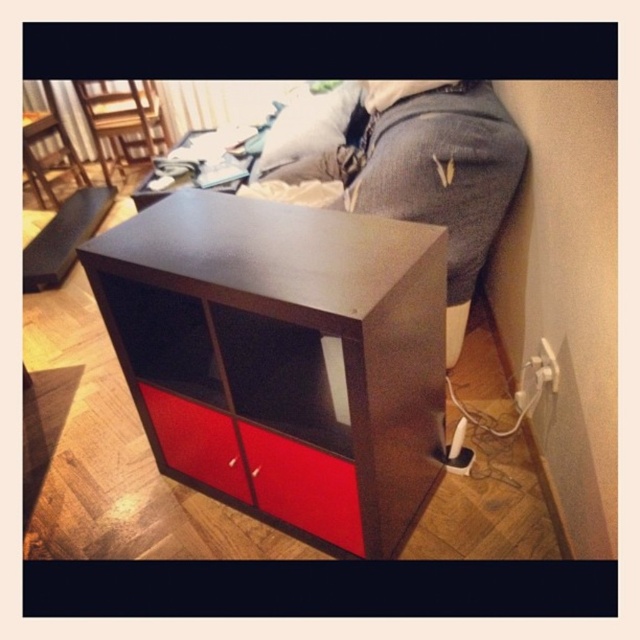
You are arranging furniture in a room and need to place the matte black cabinet at center and the matte black side table at upper center. Given their widths, which one should you place closer to the wall to save space?

The matte black side table at upper center has a narrower width compared to the matte black cabinet at center. To save space, place the matte black side table at upper center closer to the wall since it takes up less horizontal space.

You are standing in the room and want to move from the point at coordinates point (342, 467) to the point at coordinates point (189, 132). Which direction should you move to get closer to your destination?

To move from point (342, 467) to point (189, 132), you should move towards the left and downward since point (342, 467) is in front of point (189, 132), indicating it is closer to the viewer. Moving left and down would align with the coordinate system where lower x and y values correspond to left and downward directions respectively.

You are standing in the room and want to place a small plant pot that is 2 feet tall on the floor. The plant pot needs to be placed at a specific point marked as point [212,326]. Is there enough space between the plant pot and the modern cabinet or side table in the foreground to ensure the plant pot won not touch the cabinet?

The distance of point [212,326] from viewer is 4.12 feet. Since the plant pot is 2 feet tall, there is sufficient vertical space between the plant pot and the modern cabinet or side table in the foreground to prevent touching.